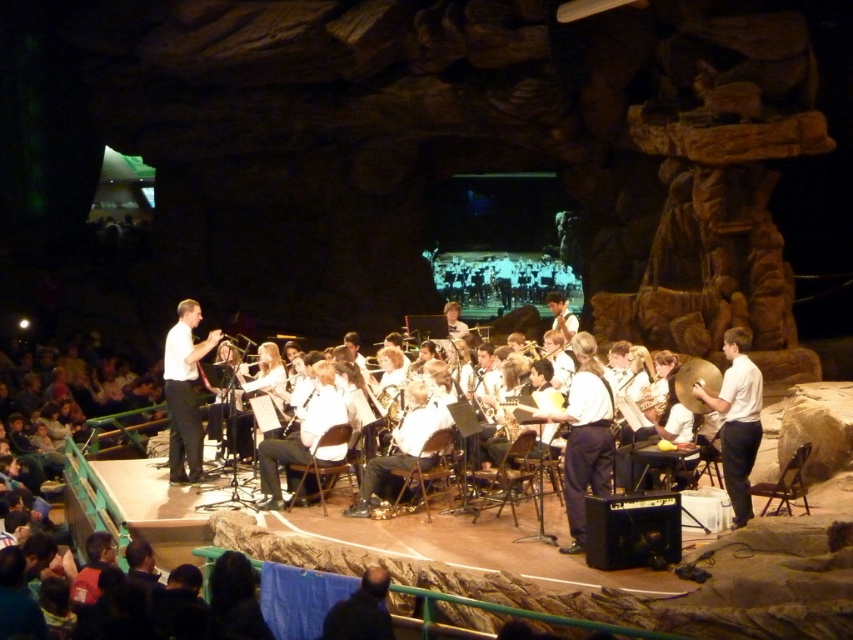
Between point (221, 336) and point (498, 413), which one is positioned in front?

Point (498, 413)

Is white smooth shirt at center to the right of gold metallic trumpet at center from the viewer's perspective?

Incorrect, white smooth shirt at center is not on the right side of gold metallic trumpet at center.

Who is more forward, [178,426] or [497,419]?

Point [497,419]

This screenshot has width=853, height=640. Find the location of `white smooth shirt at center`. white smooth shirt at center is located at coordinates [184, 394].

Between white smooth shirt at center and metallic silver clarinet at center, which one has less height?

metallic silver clarinet at center

Who is more forward, (178, 440) or (315, 381)?

Positioned in front is point (315, 381).

Where is `white smooth shirt at center`? The width and height of the screenshot is (853, 640). white smooth shirt at center is located at coordinates (184, 394).

Does point (514, 406) lie behind point (294, 436)?

No.

Between gold metallic trumpet at center and metallic silver clarinet at center, which one appears on the right side from the viewer's perspective?

gold metallic trumpet at center is more to the right.

Describe the element at coordinates (506, 417) in the screenshot. The width and height of the screenshot is (853, 640). I see `gold metallic trumpet at center` at that location.

Find the location of a particular element. gold metallic trumpet at center is located at coordinates (506, 417).